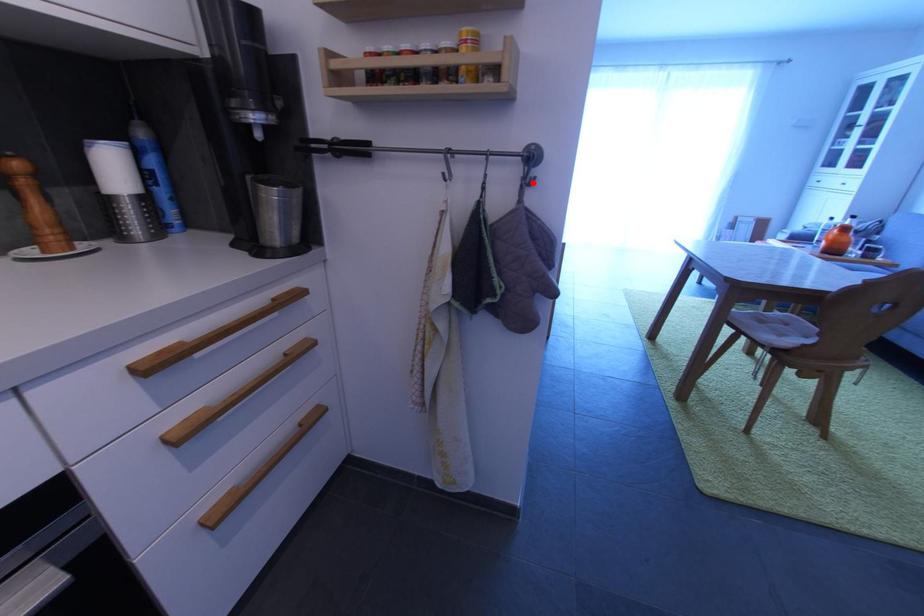
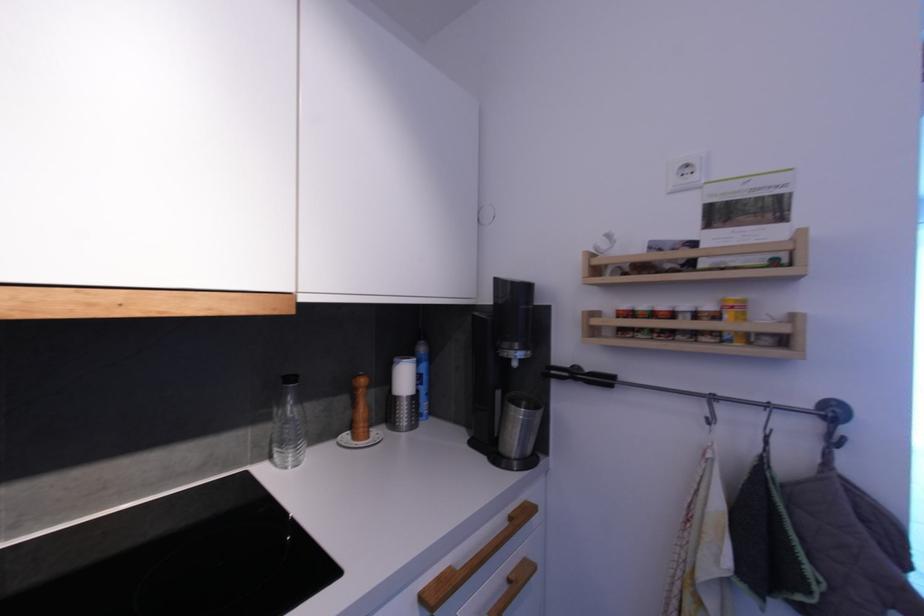
Find the pixel in the second image that matches the highlighted location in the first image.

(837, 442)